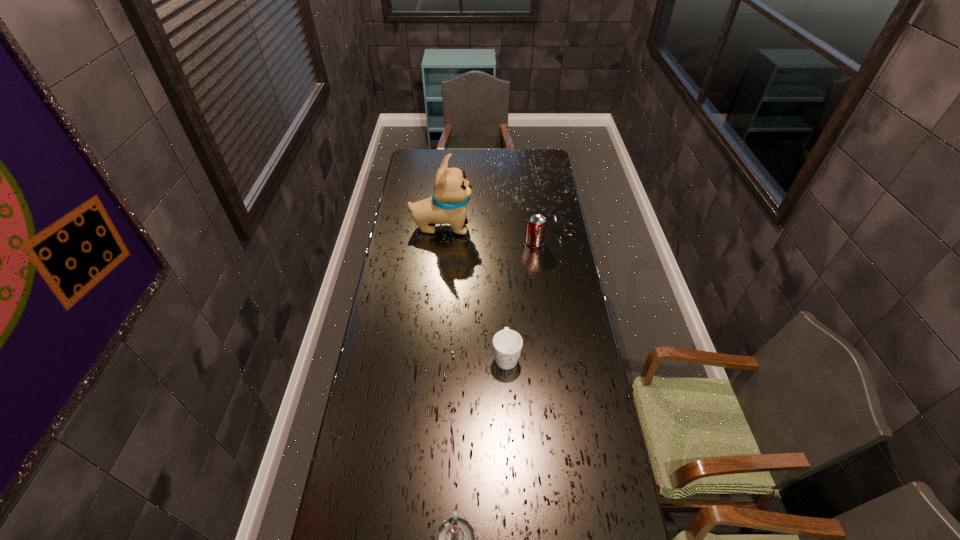
At what (x,y) coordinates should I click in order to perform the action: click on vacant position at the left edge of the desktop. Please return your answer as a coordinate pair (x, y). This screenshot has width=960, height=540. Looking at the image, I should click on click(x=405, y=288).

Identify the location of free location at the right edge. This screenshot has width=960, height=540. (560, 361).

Locate an element on the screen. Image resolution: width=960 pixels, height=540 pixels. vacant position at the far right corner of the desktop is located at coordinates (554, 171).

The height and width of the screenshot is (540, 960). In order to click on free space between the puppy and the soda can in this screenshot , I will do `click(489, 234)`.

Image resolution: width=960 pixels, height=540 pixels. Identify the location of free spot between the soda can and the mug. (520, 300).

Find the location of a particular element. The height and width of the screenshot is (540, 960). free point between the tallest object and the soda can is located at coordinates (489, 234).

This screenshot has width=960, height=540. I want to click on vacant area that lies between the rightmost object and the puppy, so click(489, 234).

The height and width of the screenshot is (540, 960). Find the location of `empty space between the rightmost object and the tallest object`. empty space between the rightmost object and the tallest object is located at coordinates (489, 234).

I want to click on empty space between the third object from left to right and the soda can, so click(520, 300).

Image resolution: width=960 pixels, height=540 pixels. What are the coordinates of `blank region between the tallest object and the third farthest object` in the screenshot? It's located at (474, 292).